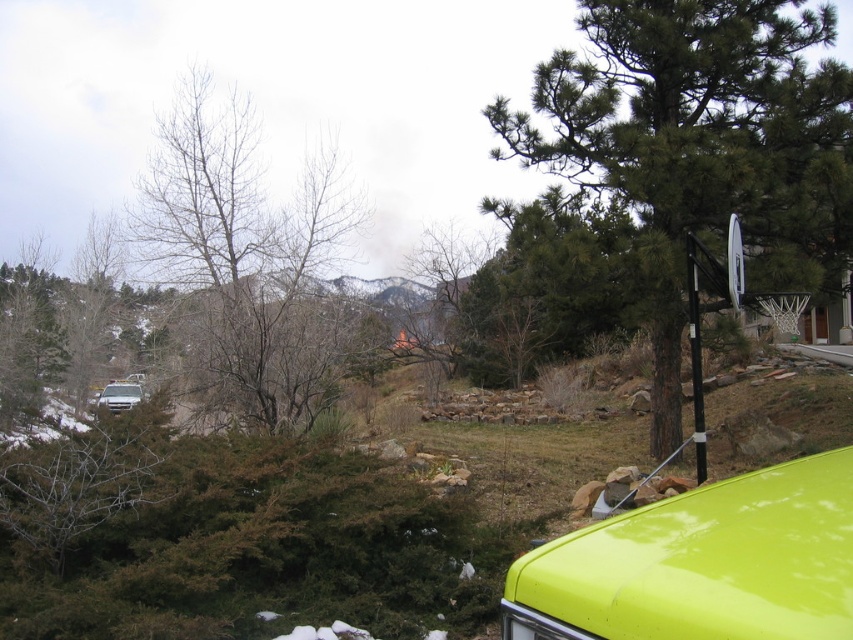
You are a photographer holding a camera and want to take a picture of the lime green plastic truck at lower right. If you are standing 1.5 meters away from the truck, will you be able to capture it in your shot without moving closer?

The lime green plastic truck at lower right and camera are 1.51 meters apart, so you are slightly too far away to capture it clearly without moving closer since you need to be at least 1.5 meters close.

You are standing in the backyard and want to take a photo of the bare branches at left. If your camera has a maximum focus range of 10 meters, will it be able to capture the branches clearly?

The bare branches at left are 9.82 meters away from the viewer, so the camera can focus on them clearly since it is within the 10 meters range.